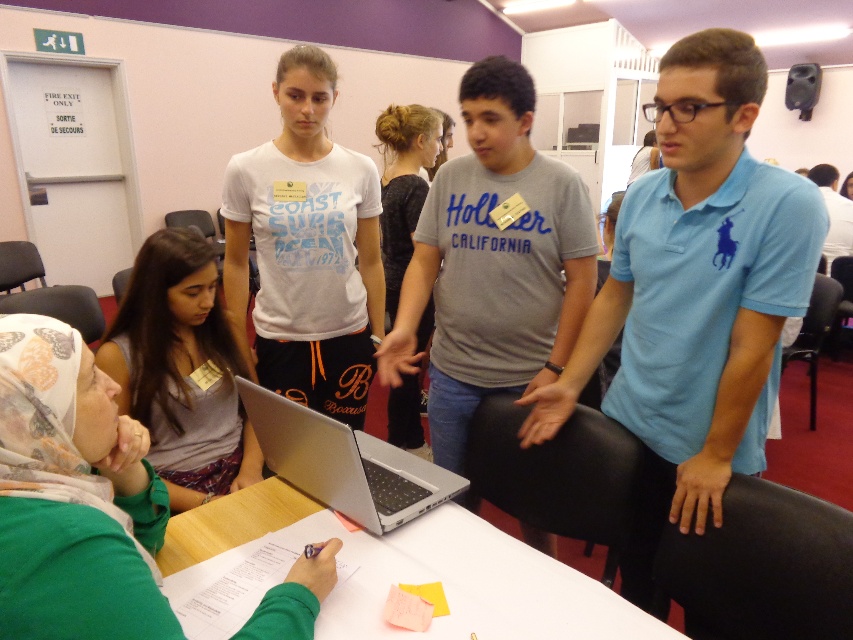
Question: Is matte gray laptop at center closer to camera compared to white paper at center?

Choices:
 (A) no
 (B) yes

Answer: (B)

Question: Which point is farther to the camera?

Choices:
 (A) dark gray fabric shirt at center
 (B) matte gray laptop at center
 (C) silver metallic laptop at center
 (D) matte gray shirt at center

Answer: (A)

Question: Does matte gray laptop at center have a lesser width compared to matte gray shirt at center?

Choices:
 (A) no
 (B) yes

Answer: (A)

Question: Which of the following is the farthest from the observer?

Choices:
 (A) (239, 269)
 (B) (125, 292)
 (C) (444, 477)
 (D) (467, 560)

Answer: (A)

Question: Can you confirm if white paper at center is positioned to the left of dark gray fabric shirt at center?

Choices:
 (A) no
 (B) yes

Answer: (A)

Question: Which of the following is the closest to the observer?

Choices:
 (A) (312, 234)
 (B) (144, 481)

Answer: (B)